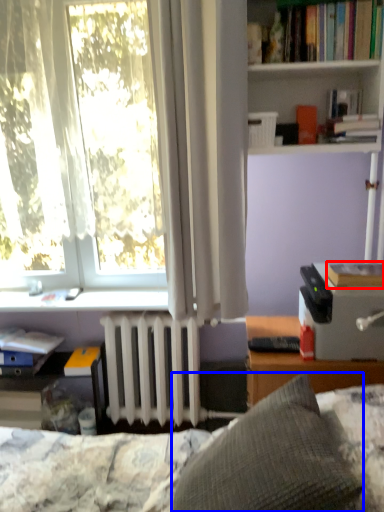
Question: Which object is further to the camera taking this photo, book (highlighted by a red box) or pillow (highlighted by a blue box)?

Choices:
 (A) book
 (B) pillow

Answer: (A)